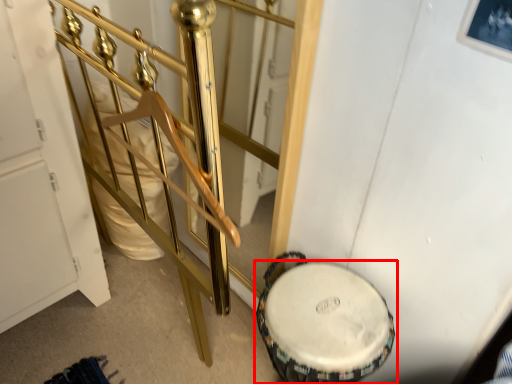
Question: Observing the image, what is the correct spatial positioning of drum (annotated by the red box) in reference to rail?

Choices:
 (A) left
 (B) right

Answer: (B)